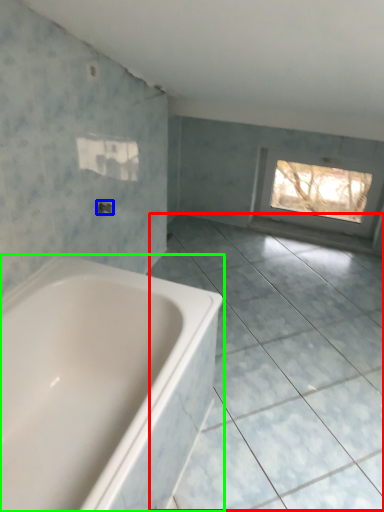
Question: Considering the real-world distances, which object is farthest from ceramic tile (highlighted by a red box)? tap (highlighted by a blue box) or bathtub (highlighted by a green box)?

Choices:
 (A) tap
 (B) bathtub

Answer: (A)